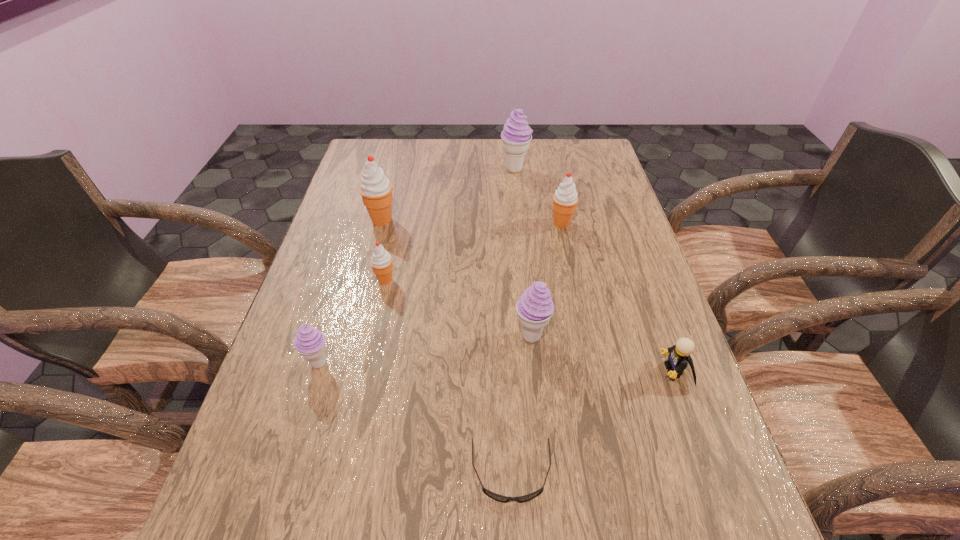
Locate an element on the screen. The width and height of the screenshot is (960, 540). the nearest purple icecream is located at coordinates (309, 342).

The height and width of the screenshot is (540, 960). In order to click on the second shortest object in this screenshot , I will do point(679,354).

Identify the location of the rightmost object. This screenshot has width=960, height=540. (679, 354).

The width and height of the screenshot is (960, 540). I want to click on the nearest object, so click(500, 498).

Locate an element on the screen. The width and height of the screenshot is (960, 540). the shortest object is located at coordinates (500, 498).

Locate an element on the screen. free space located on the right of the farthest object is located at coordinates (554, 169).

Find the location of a particular element. The height and width of the screenshot is (540, 960). vacant space located 0.340m on the back of the biggest red icecream is located at coordinates (399, 153).

Where is `free point located 0.090m on the right of the seventh object from left to right`? This screenshot has height=540, width=960. free point located 0.090m on the right of the seventh object from left to right is located at coordinates (605, 223).

The width and height of the screenshot is (960, 540). In order to click on vacant space situated on the back of the second farthest purple icecream in this screenshot , I will do `click(522, 249)`.

Where is `free space located 0.170m on the front of the fourth farthest object`? The image size is (960, 540). free space located 0.170m on the front of the fourth farthest object is located at coordinates (372, 344).